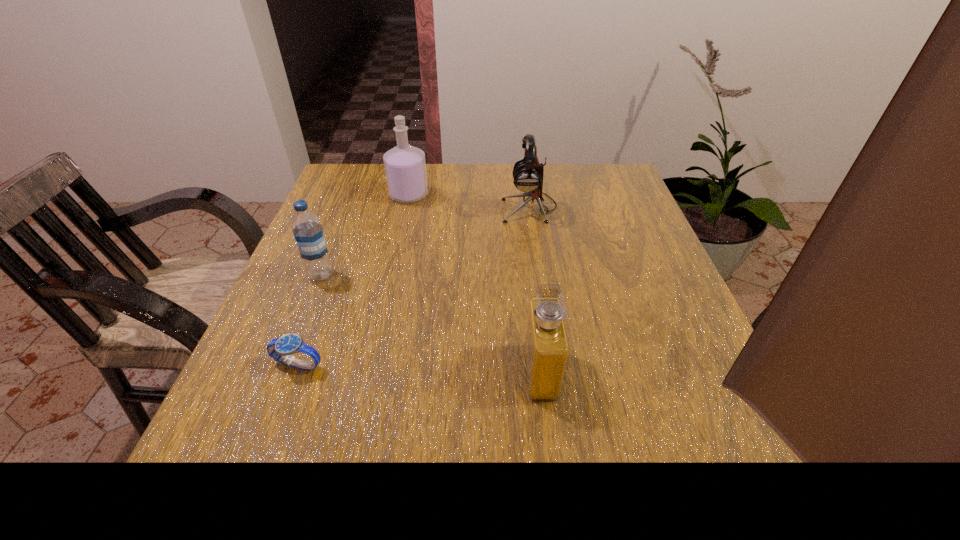
Locate an element on the screen. the taller perfume is located at coordinates point(405,167).

Find the location of `the farther perfume`. the farther perfume is located at coordinates (405, 167).

Identify the location of earphone. The image size is (960, 540). (528, 173).

I want to click on the right perfume, so click(546, 346).

I want to click on the shorter perfume, so click(546, 346).

Where is `the third nearest object`? This screenshot has height=540, width=960. the third nearest object is located at coordinates (306, 226).

You are a GUI agent. You are given a task and a screenshot of the screen. Output one action in this format:
    pyautogui.click(x=<x>, y=<y>)
    Task: Click on the watch
    This screenshot has height=540, width=960.
    Given the screenshot: What is the action you would take?
    pyautogui.click(x=281, y=349)

Find the location of a particular element. free space located on the back of the left perfume is located at coordinates (414, 173).

Where is `free space located on the front of the earphone`? free space located on the front of the earphone is located at coordinates (538, 260).

Locate an element on the screen. Image resolution: width=960 pixels, height=540 pixels. vacant area situated on the front-facing side of the shorter perfume is located at coordinates coord(292,372).